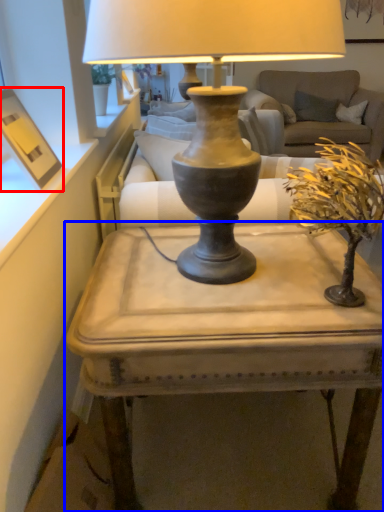
Question: Which of the following is the closest to the observer, picture frame (highlighted by a red box) or table (highlighted by a blue box)?

Choices:
 (A) picture frame
 (B) table

Answer: (B)